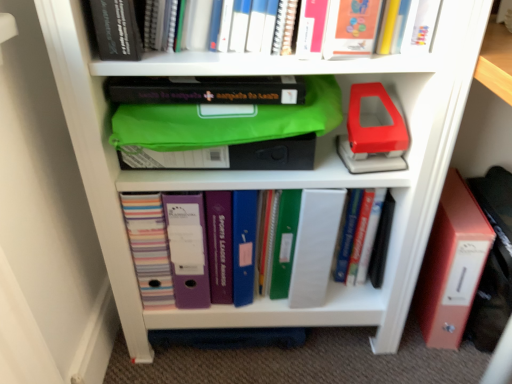
Where is `matte plastic folders at center, arranged as the 1th book when viewed from the back`? matte plastic folders at center, arranged as the 1th book when viewed from the back is located at coordinates (302, 243).

Describe the element at coordinates (302, 243) in the screenshot. Image resolution: width=512 pixels, height=384 pixels. I see `matte plastic folders at center, arranged as the 1th book when viewed from the back` at that location.

I want to click on hardcover book at upper left, which is the 1th book in top-to-bottom order, so click(116, 30).

Image resolution: width=512 pixels, height=384 pixels. What do you see at coordinates (116, 30) in the screenshot?
I see `hardcover book at upper left, which appears as the second book when viewed from the back` at bounding box center [116, 30].

Where is `matte plastic folders at center, arranged as the 1th book when viewed from the back`? matte plastic folders at center, arranged as the 1th book when viewed from the back is located at coordinates (302, 243).

In the image, is matte plastic folders at center, arranged as the 1th book when viewed from the back, on the left side or the right side of hardcover book at upper left, which is the 2th book from bottom to top?

Clearly, matte plastic folders at center, arranged as the 1th book when viewed from the back, is on the right of hardcover book at upper left, which is the 2th book from bottom to top, in the image.

Relative to hardcover book at upper left, which ranks as the first book in front-to-back order, is matte plastic folders at center, arranged as the 1th book when viewed from the back, in front or behind?

matte plastic folders at center, arranged as the 1th book when viewed from the back, is positioned farther from the viewer than hardcover book at upper left, which ranks as the first book in front-to-back order.

Between point (327, 223) and point (119, 20), which one is positioned behind?

The point (327, 223) is farther from the camera.

From the image's perspective, which one is positioned higher, matte plastic folders at center, placed as the 2th book when sorted from front to back, or hardcover book at upper left, which ranks as the first book in front-to-back order?

From the image's view, hardcover book at upper left, which ranks as the first book in front-to-back order, is above.

Looking at this image, from a real-world perspective, is matte plastic folders at center, which is the 2th book from top to bottom, under hardcover book at upper left, which ranks as the first book in front-to-back order?

Yes, from a real-world perspective, matte plastic folders at center, which is the 2th book from top to bottom, is beneath hardcover book at upper left, which ranks as the first book in front-to-back order.

Which object is thinner, matte plastic folders at center, which is the 2th book from top to bottom, or hardcover book at upper left, which appears as the second book when viewed from the back?

matte plastic folders at center, which is the 2th book from top to bottom.

Considering the sizes of matte plastic folders at center, arranged as the 1th book when viewed from the back, and hardcover book at upper left, which is the 1th book in top-to-bottom order, in the image, is matte plastic folders at center, arranged as the 1th book when viewed from the back, taller or shorter than hardcover book at upper left, which is the 1th book in top-to-bottom order,?

Clearly, matte plastic folders at center, arranged as the 1th book when viewed from the back, is taller compared to hardcover book at upper left, which is the 1th book in top-to-bottom order.

Between matte plastic folders at center, placed as the 2th book when sorted from front to back, and hardcover book at upper left, which appears as the second book when viewed from the back, which one has smaller size?

hardcover book at upper left, which appears as the second book when viewed from the back.

Is hardcover book at upper left, which appears as the second book when viewed from the back, surrounded by matte plastic folders at center, arranged as the 1th book when viewed from the back?

No, matte plastic folders at center, arranged as the 1th book when viewed from the back, does not contain hardcover book at upper left, which appears as the second book when viewed from the back.

Is the surface of matte plastic folders at center, arranged as the 1th book when viewed from the back, in direct contact with hardcover book at upper left, which appears as the second book when viewed from the back?

No.

Is matte plastic folders at center, positioned as the first book in bottom-to-top order, looking in the opposite direction of hardcover book at upper left, which appears as the second book when viewed from the back?

That's not correct — matte plastic folders at center, positioned as the first book in bottom-to-top order, is not looking away from hardcover book at upper left, which appears as the second book when viewed from the back.

What's the angular difference between matte plastic folders at center, arranged as the 1th book when viewed from the back, and hardcover book at upper left, which is the 2th book from bottom to top,'s facing directions?

Answer: There is a 0.544-degree angle between the facing directions of matte plastic folders at center, arranged as the 1th book when viewed from the back, and hardcover book at upper left, which is the 2th book from bottom to top.

This screenshot has width=512, height=384. I want to click on book that appears above the matte plastic folders at center, arranged as the 1th book when viewed from the back (from a real-world perspective), so click(x=116, y=30).

In the image, is hardcover book at upper left, which is the 1th book in top-to-bottom order, on the left side or the right side of matte plastic folders at center, placed as the 2th book when sorted from front to back?

From the image, it's evident that hardcover book at upper left, which is the 1th book in top-to-bottom order, is to the left of matte plastic folders at center, placed as the 2th book when sorted from front to back.

Which object is further away from the camera, hardcover book at upper left, which ranks as the first book in front-to-back order, or matte plastic folders at center, positioned as the first book in bottom-to-top order?

Positioned behind is matte plastic folders at center, positioned as the first book in bottom-to-top order.

Is point (112, 26) behind point (145, 263)?

No, (112, 26) is in front of (145, 263).

From the image's perspective, is hardcover book at upper left, which appears as the second book when viewed from the back, on top of matte plastic folders at center, placed as the 2th book when sorted from front to back?

Yes, from the image's perspective, hardcover book at upper left, which appears as the second book when viewed from the back, is on top of matte plastic folders at center, placed as the 2th book when sorted from front to back.

From a real-world perspective, does hardcover book at upper left, which ranks as the first book in front-to-back order, stand above matte plastic folders at center, which is the 2th book from top to bottom?

Yes, from a real-world perspective, hardcover book at upper left, which ranks as the first book in front-to-back order, is over matte plastic folders at center, which is the 2th book from top to bottom

Can you confirm if hardcover book at upper left, which is the 1th book in top-to-bottom order, is wider than matte plastic folders at center, which is the 2th book from top to bottom?

Yes.

From their relative heights in the image, would you say hardcover book at upper left, which is the 1th book in top-to-bottom order, is taller or shorter than matte plastic folders at center, placed as the 2th book when sorted from front to back?

Clearly, hardcover book at upper left, which is the 1th book in top-to-bottom order, is shorter compared to matte plastic folders at center, placed as the 2th book when sorted from front to back.

In the scene shown: Is hardcover book at upper left, which ranks as the first book in front-to-back order, bigger or smaller than matte plastic folders at center, which is the 2th book from top to bottom?

Considering their sizes, hardcover book at upper left, which ranks as the first book in front-to-back order, takes up less space than matte plastic folders at center, which is the 2th book from top to bottom.

Would you say hardcover book at upper left, which is the 2th book from bottom to top, is inside or outside matte plastic folders at center, placed as the 2th book when sorted from front to back?

The correct answer is: outside.

Does hardcover book at upper left, which is the 1th book in top-to-bottom order, touch matte plastic folders at center, arranged as the 1th book when viewed from the back?

They are not placed beside each other.

Is hardcover book at upper left, which ranks as the first book in front-to-back order, oriented towards matte plastic folders at center, placed as the 2th book when sorted from front to back?

No.

What's the angular difference between hardcover book at upper left, which is the 2th book from bottom to top, and matte plastic folders at center, arranged as the 1th book when viewed from the back,'s facing directions?

0.544 degrees separate the facing orientations of hardcover book at upper left, which is the 2th book from bottom to top, and matte plastic folders at center, arranged as the 1th book when viewed from the back.

Locate an element on the screen. The image size is (512, 384). book that appears on the left of matte plastic folders at center, placed as the 2th book when sorted from front to back is located at coordinates (116, 30).

Where is `book that is in front of the matte plastic folders at center, positioned as the first book in bottom-to-top order`? This screenshot has width=512, height=384. book that is in front of the matte plastic folders at center, positioned as the first book in bottom-to-top order is located at coordinates (116, 30).

This screenshot has height=384, width=512. I want to click on book on the right of hardcover book at upper left, which appears as the second book when viewed from the back, so click(x=302, y=243).